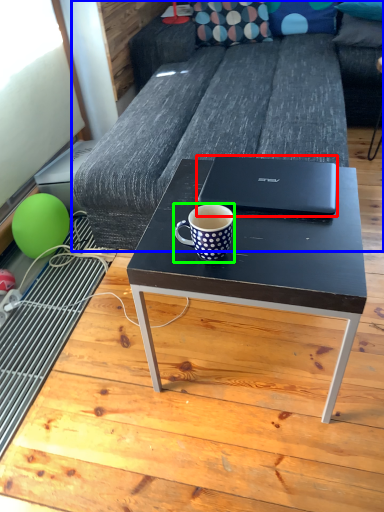
Question: Which object is the closest to the laptop (highlighted by a red box)? Choose among these: studio couch (highlighted by a blue box) or coffee cup (highlighted by a green box).

Choices:
 (A) studio couch
 (B) coffee cup

Answer: (B)